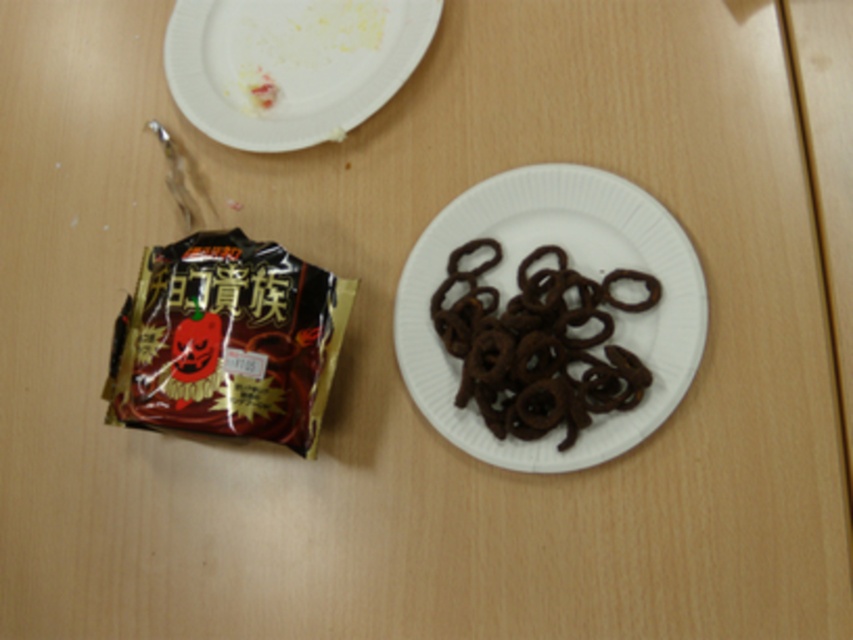
Between black matte snack at left and white paper plate at upper left, which one has more height?

black matte snack at left

Is black matte snack at left in front of white paper plate at upper left?

Yes, it is.

Is point (158, 320) closer to viewer compared to point (244, 72)?

Yes, it is in front of point (244, 72).

I want to click on black matte snack at left, so click(229, 340).

Which is behind, point (396, 292) or point (264, 362)?

Point (396, 292)

Is white paper plate at center positioned before black matte snack at left?

Yes, it is in front of black matte snack at left.

This screenshot has height=640, width=853. What are the coordinates of `white paper plate at center` in the screenshot? It's located at (573, 268).

Who is positioned more to the right, white paper plate at center or white paper plate at upper left?

Positioned to the right is white paper plate at center.

Image resolution: width=853 pixels, height=640 pixels. Describe the element at coordinates (573, 268) in the screenshot. I see `white paper plate at center` at that location.

The width and height of the screenshot is (853, 640). I want to click on white paper plate at center, so click(x=573, y=268).